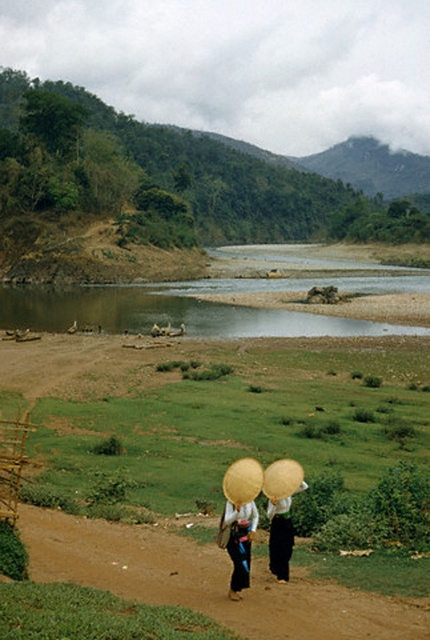
You are a hiker who wants to cross the brown sedimentary river at center. You see a wooden woven basket at lower left nearby. Which object is closer to you, the hiker?

The wooden woven basket at lower left is closer to you because it is positioned closer to the viewer than the brown sedimentary river at center.